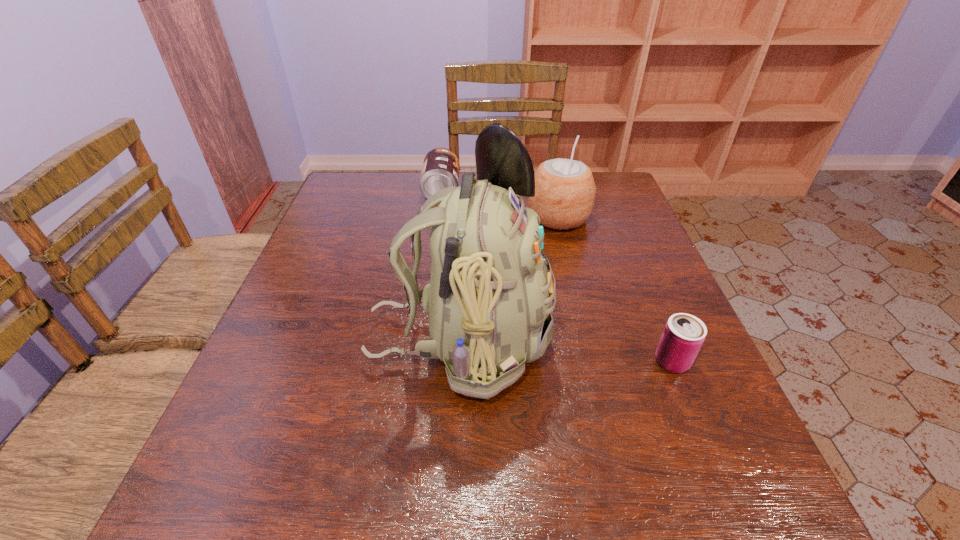
I want to click on the tallest object, so click(489, 301).

Image resolution: width=960 pixels, height=540 pixels. What are the coordinates of `coconut` in the screenshot? It's located at (565, 190).

The image size is (960, 540). I want to click on the left can, so click(441, 166).

Where is `the nearer can`? This screenshot has height=540, width=960. the nearer can is located at coordinates (684, 334).

Locate an element on the screen. Image resolution: width=960 pixels, height=540 pixels. the right can is located at coordinates (684, 334).

At what (x,y) coordinates should I click in order to perform the action: click on vacant space located on the front-facing side of the backpack. Please return your answer as a coordinate pair (x, y). Looking at the image, I should click on (574, 341).

This screenshot has width=960, height=540. Identify the location of free space located 0.230m on the front of the third shortest object. (578, 298).

Where is `vacant area situated on the front label of the farther can`? The image size is (960, 540). vacant area situated on the front label of the farther can is located at coordinates (530, 191).

The width and height of the screenshot is (960, 540). What are the coordinates of `free space located 0.180m on the front of the nearer can` in the screenshot? It's located at (718, 474).

Find the location of a particular element. This screenshot has width=960, height=540. coconut located in the far edge section of the desktop is located at coordinates (565, 190).